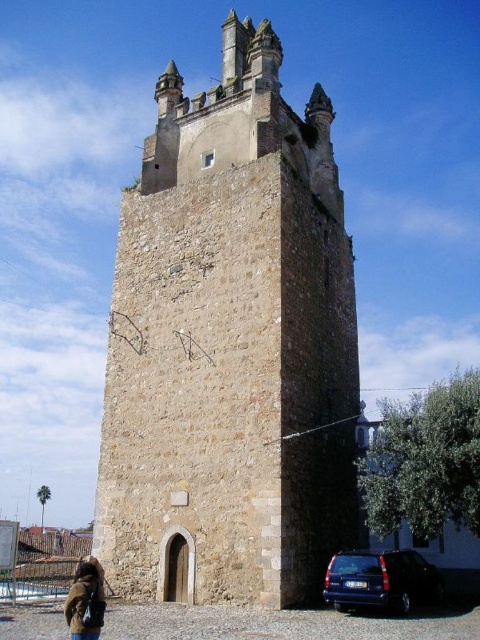
Is blue metallic van at lower right to the right of brown leather jacket at lower left from the viewer's perspective?

Yes, blue metallic van at lower right is to the right of brown leather jacket at lower left.

Between point (408, 580) and point (97, 609), which one is positioned in front?

Positioned in front is point (97, 609).

Is point (344, 580) closer to camera compared to point (76, 628)?

No, it is behind (76, 628).

The image size is (480, 640). In order to click on blue metallic van at lower right in this screenshot , I will do `click(381, 580)`.

Does brown stone tower at center have a greater height compared to blue metallic van at lower right?

Yes.

Is brown stone tower at center bigger than blue metallic van at lower right?

Indeed, brown stone tower at center has a larger size compared to blue metallic van at lower right.

Where is `brown stone tower at center`? The height and width of the screenshot is (640, 480). brown stone tower at center is located at coordinates (229, 346).

Locate an element on the screen. brown stone tower at center is located at coordinates (229, 346).

Does brown stone tower at center appear over brown leather jacket at lower left?

Yes, brown stone tower at center is above brown leather jacket at lower left.

Between point (182, 552) and point (76, 572), which one is positioned in front?

Point (182, 552)

Between point (261, 433) and point (84, 605), which one is positioned in front?

Point (84, 605) is more forward.

You are a GUI agent. You are given a task and a screenshot of the screen. Output one action in this format:
    pyautogui.click(x=<x>, y=<y>)
    Task: Click on the brown stone tower at center
    This screenshot has height=640, width=480.
    Given the screenshot: What is the action you would take?
    pyautogui.click(x=229, y=346)